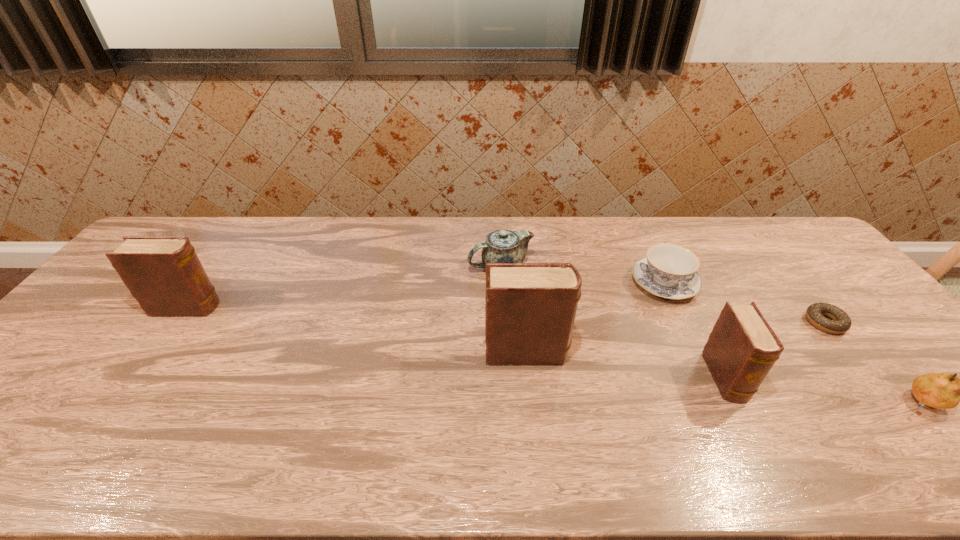
Where is `object located in the far edge section of the desktop`? The height and width of the screenshot is (540, 960). object located in the far edge section of the desktop is located at coordinates (502, 246).

At what (x,y) coordinates should I click in order to perform the action: click on diary present at the near edge. Please return your answer as a coordinate pair (x, y). This screenshot has height=540, width=960. Looking at the image, I should click on coord(742,348).

You are a GUI agent. You are given a task and a screenshot of the screen. Output one action in this format:
    pyautogui.click(x=<x>, y=<y>)
    Task: Click on the pear located at the near edge
    This screenshot has width=960, height=540.
    Given the screenshot: What is the action you would take?
    pyautogui.click(x=938, y=390)

At what (x,y) coordinates should I click in order to perform the action: click on doughnut at the right edge. Please return your answer as a coordinate pair (x, y). Looking at the image, I should click on (841, 322).

Locate an element on the screen. The height and width of the screenshot is (540, 960). pear at the right edge is located at coordinates click(x=938, y=390).

Identify the location of object situated at the near right corner. (938, 390).

This screenshot has height=540, width=960. In the image, there is a desktop. Identify the location of vacant space at the far edge. (x=246, y=231).

Find the location of `vacant space at the near edge`. vacant space at the near edge is located at coordinates (718, 413).

You are a GUI agent. You are given a task and a screenshot of the screen. Output one action in this format:
    pyautogui.click(x=<x>, y=<y>)
    Task: Click on the vacant space at the far left corner of the desktop
    The image size is (960, 540).
    Given the screenshot: What is the action you would take?
    pyautogui.click(x=198, y=230)

Find the location of a particular element. vacant area that lies between the second diary from left to right and the second tallest diary is located at coordinates (357, 329).